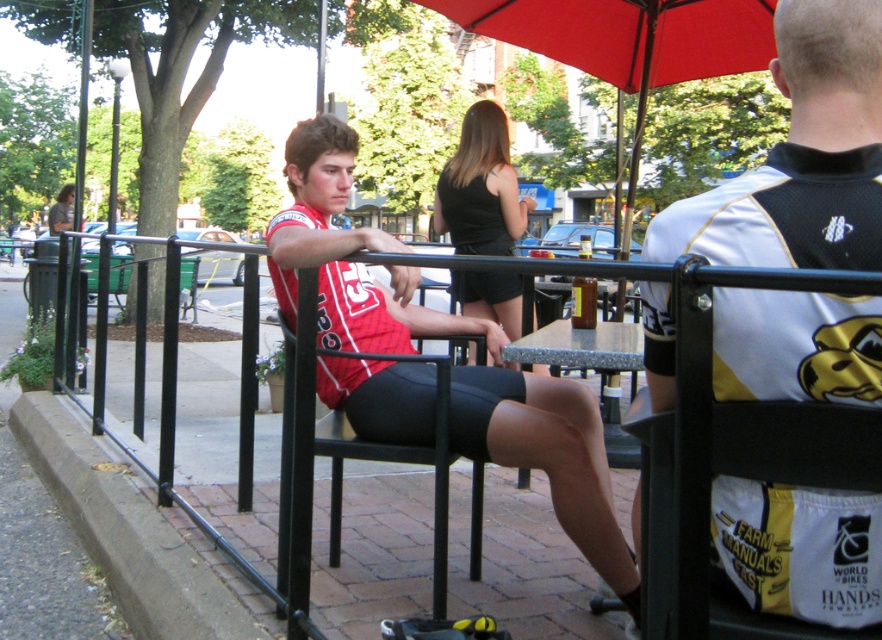
You are standing at the entrance of the outdoor seating area. There is a point marked at coordinates point (168, 413). If you want to place a 10 feet long banner from your current position to that point, will it reach?

The distance of point (168, 413) from viewer is 9.39 feet, so the 10 feet long banner will reach the point as it is longer than the distance.

Looking at this image, you are standing at the point labeled as point (610, 532) in the image. You want to place a small potted plant exactly 2 meters away from your current position. Is this possible within the seating area?

The distance between you and the point (610, 532) is 1.83 meters. Since you need to place the plant 2 meters away, it is not possible to do so within the seating area as the required distance exceeds the available space.